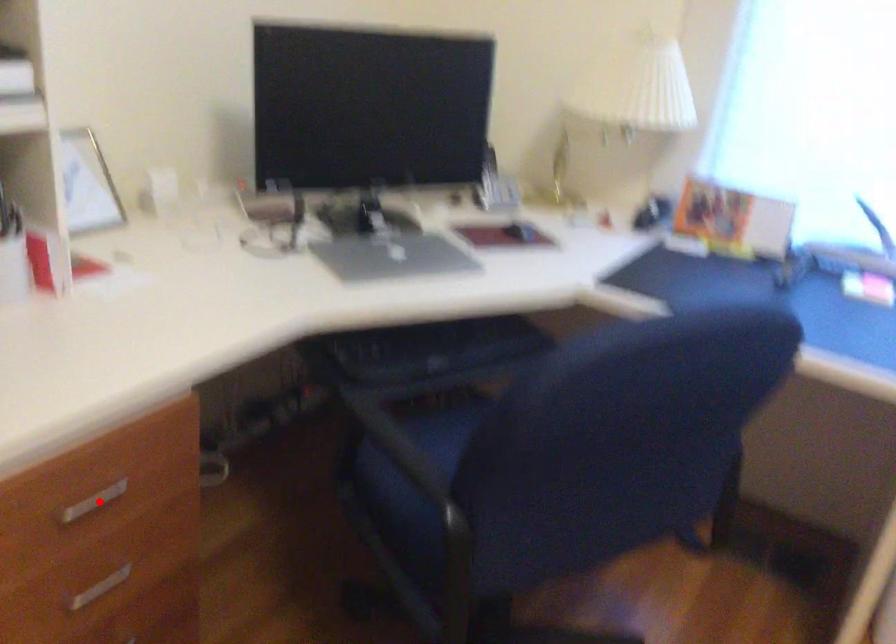
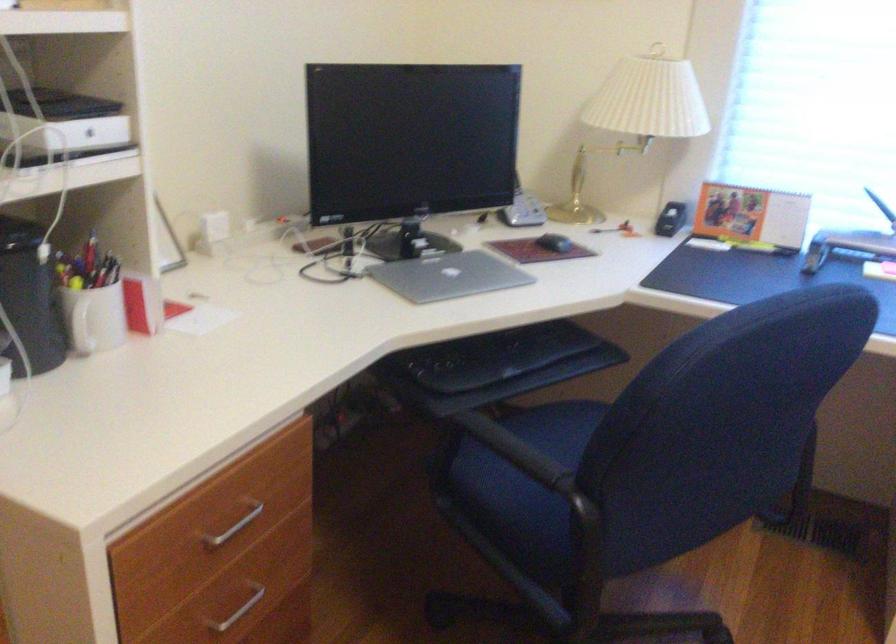
The point at the highlighted location is marked in the first image. Where is the corresponding point in the second image?

(231, 527)